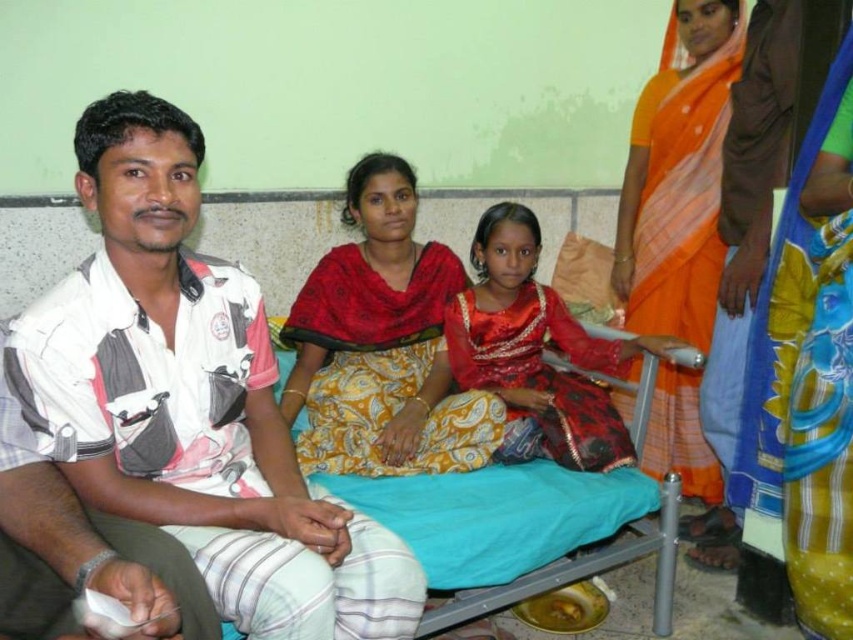
Question: Is white printed shirt at left wider than orange silk saree at upper right?

Choices:
 (A) yes
 (B) no

Answer: (A)

Question: Which point is closer to the camera?

Choices:
 (A) orange silk saree at upper right
 (B) yellow paisley sari at center

Answer: (B)

Question: Is yellow paisley sari at center behind shiny red sari at center?

Choices:
 (A) no
 (B) yes

Answer: (A)

Question: Is white printed shirt at left bigger than orange silk saree at upper right?

Choices:
 (A) no
 (B) yes

Answer: (B)

Question: Based on their relative distances, which object is nearer to the orange silk saree at upper right?

Choices:
 (A) white printed shirt at left
 (B) yellow paisley sari at center
 (C) shiny red sari at center

Answer: (C)

Question: Which point is closer to the camera taking this photo?

Choices:
 (A) (498, 253)
 (B) (318, 380)
 (C) (630, 161)
 (D) (28, 392)

Answer: (D)